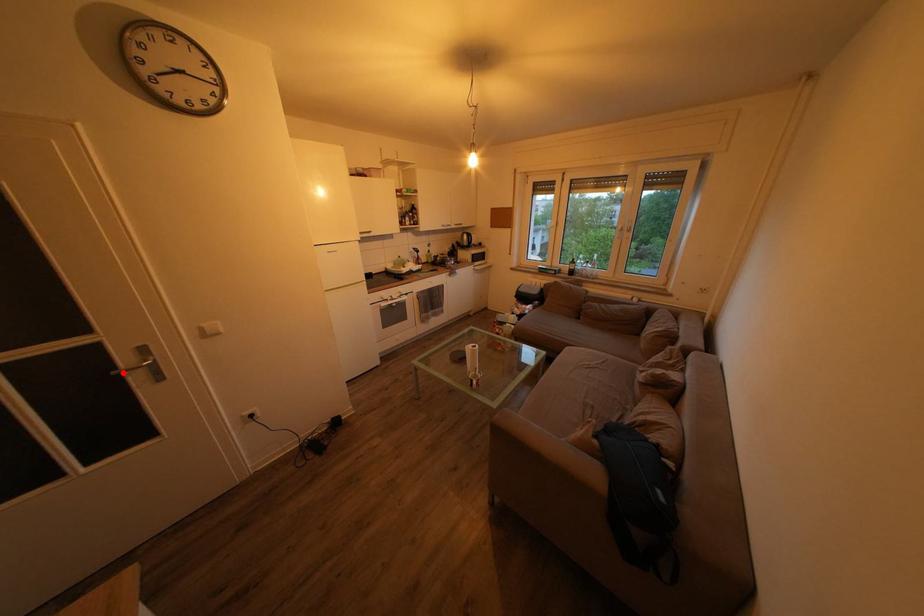
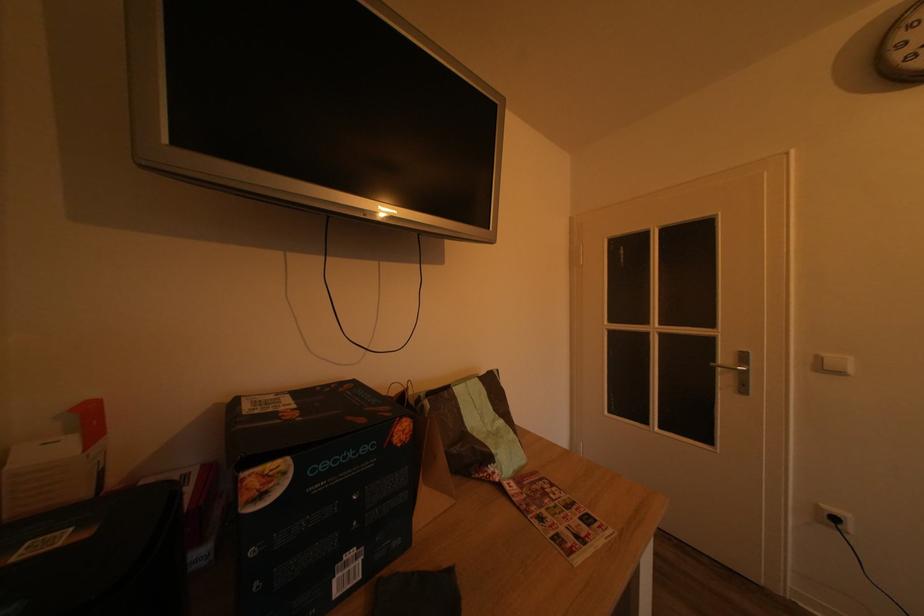
Find the pixel in the second image that matches the highlighted location in the first image.

(723, 368)